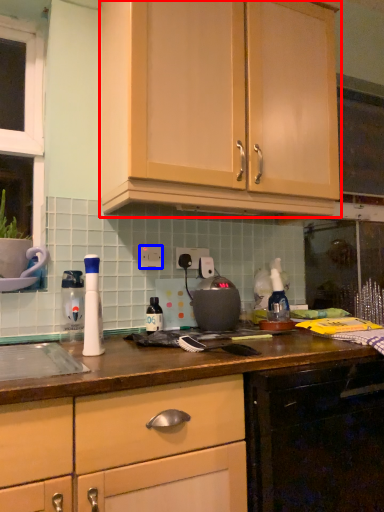
Question: Which object appears farthest to the camera in this image, cabinetry (highlighted by a red box) or electric outlet (highlighted by a blue box)?

Choices:
 (A) cabinetry
 (B) electric outlet

Answer: (B)